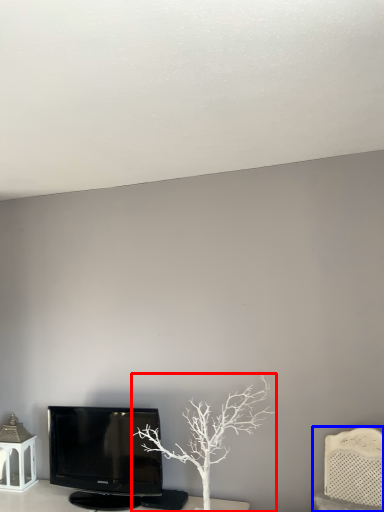
Question: Which point is further to the camera, tree (highlighted by a red box) or furniture (highlighted by a blue box)?

Choices:
 (A) tree
 (B) furniture

Answer: (A)